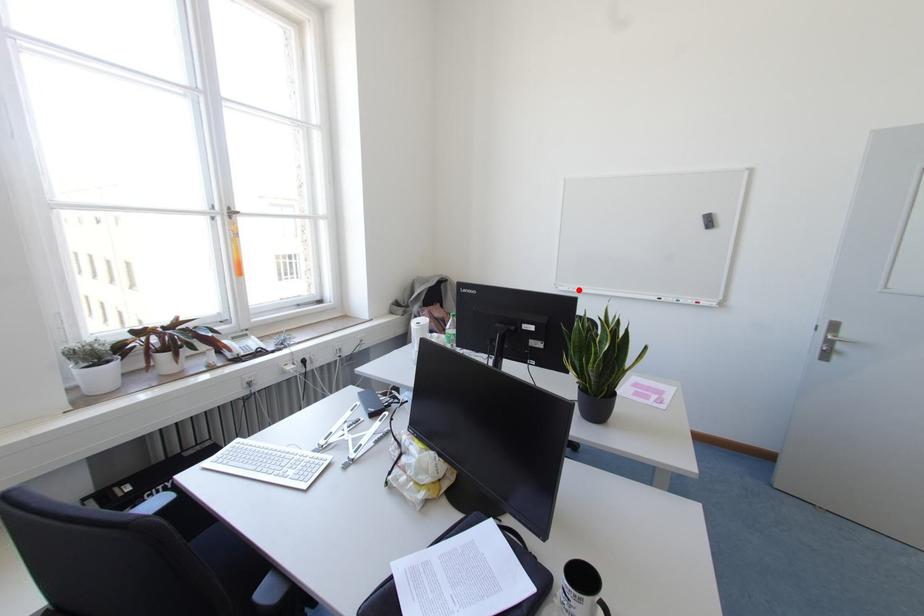
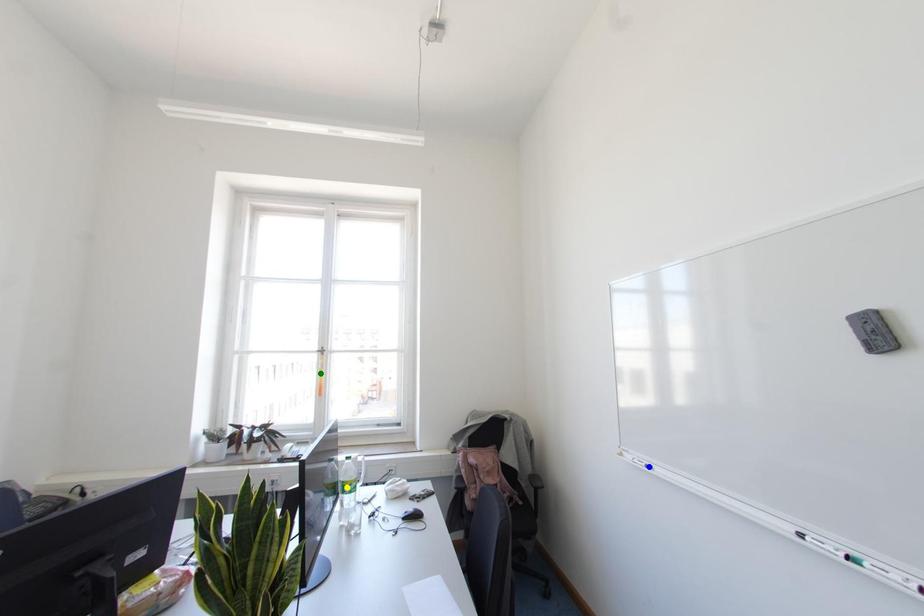
Question: I am providing you with two images of the same scene from different viewpoints. A red point is marked on the first image. You are given multiple points on the second image. Which point in image 2 is actually the same real-world point as the red point in image 1?

Choices:
 (A) green point
 (B) blue point
 (C) yellow point

Answer: (B)